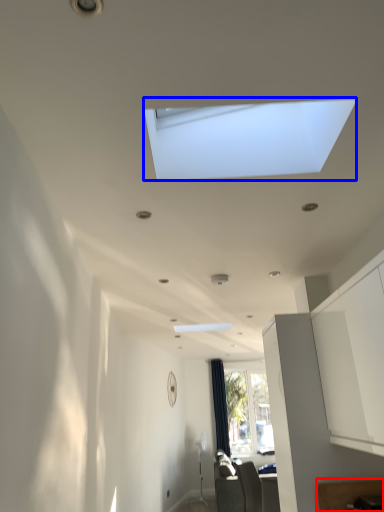
Question: Which point is closer to the camera, furniture (highlighted by a red box) or window (highlighted by a blue box)?

Choices:
 (A) furniture
 (B) window

Answer: (B)